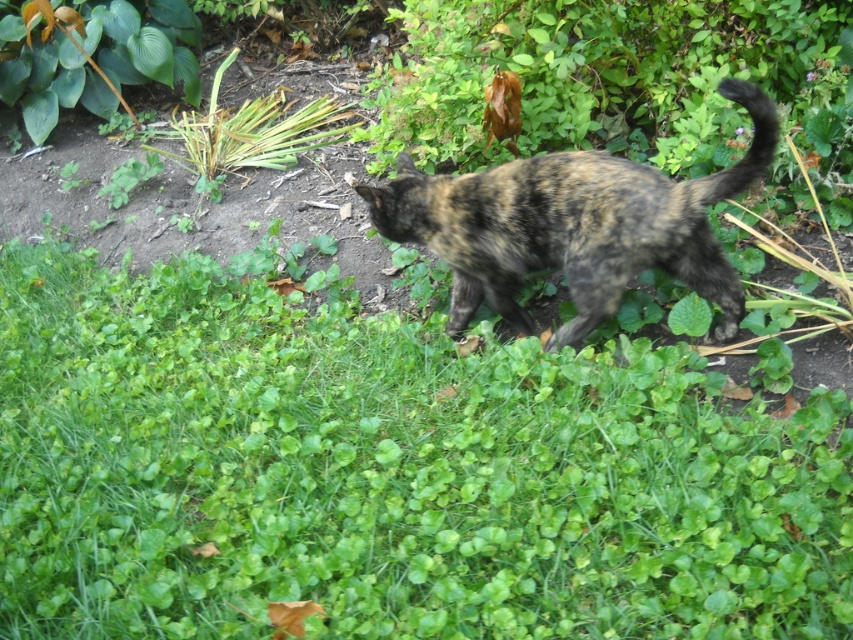
Who is positioned more to the right, tortoiseshell fur cat at center or green leafy plant at upper left?

Positioned to the right is tortoiseshell fur cat at center.

Is tortoiseshell fur cat at center smaller than green leafy plant at upper left?

Yes.

Between point (479, 264) and point (103, 83), which one is positioned behind?

The point (103, 83) is behind.

I want to click on tortoiseshell fur cat at center, so click(573, 225).

Which is above, green leafy grass at center or green leafy plant at upper left?

green leafy plant at upper left is above.

At what (x,y) coordinates should I click in order to perform the action: click on green leafy grass at center. Please return your answer as a coordinate pair (x, y). The height and width of the screenshot is (640, 853). Looking at the image, I should click on (387, 474).

The height and width of the screenshot is (640, 853). In order to click on green leafy grass at center in this screenshot , I will do `click(387, 474)`.

This screenshot has height=640, width=853. What are the coordinates of `green leafy grass at center` in the screenshot? It's located at (387, 474).

Can you confirm if green leafy grass at center is taller than tortoiseshell fur cat at center?

Correct, green leafy grass at center is much taller as tortoiseshell fur cat at center.

The height and width of the screenshot is (640, 853). I want to click on green leafy grass at center, so click(x=387, y=474).